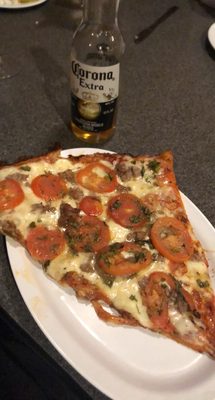
I want to click on oval plate, so pyautogui.click(x=100, y=361).